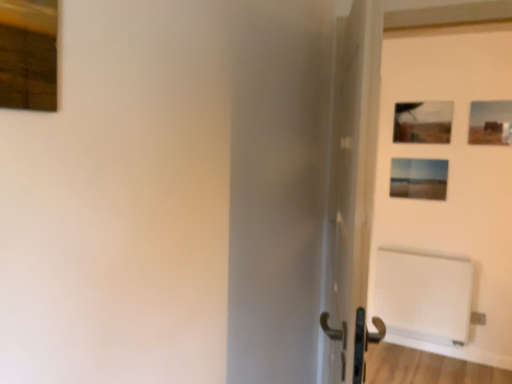
The height and width of the screenshot is (384, 512). I want to click on free spot above white textured radiator at lower right (from a real-world perspective), so point(422,254).